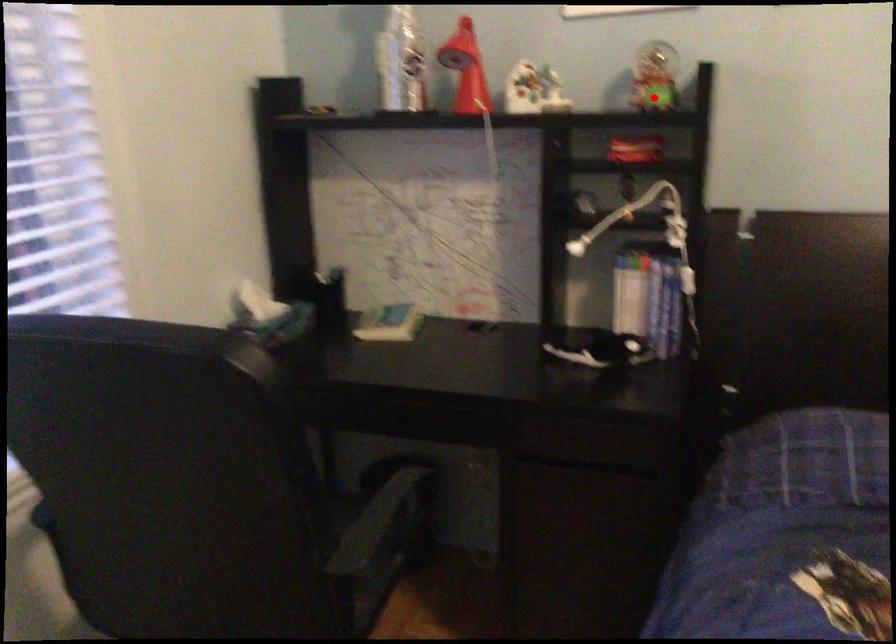
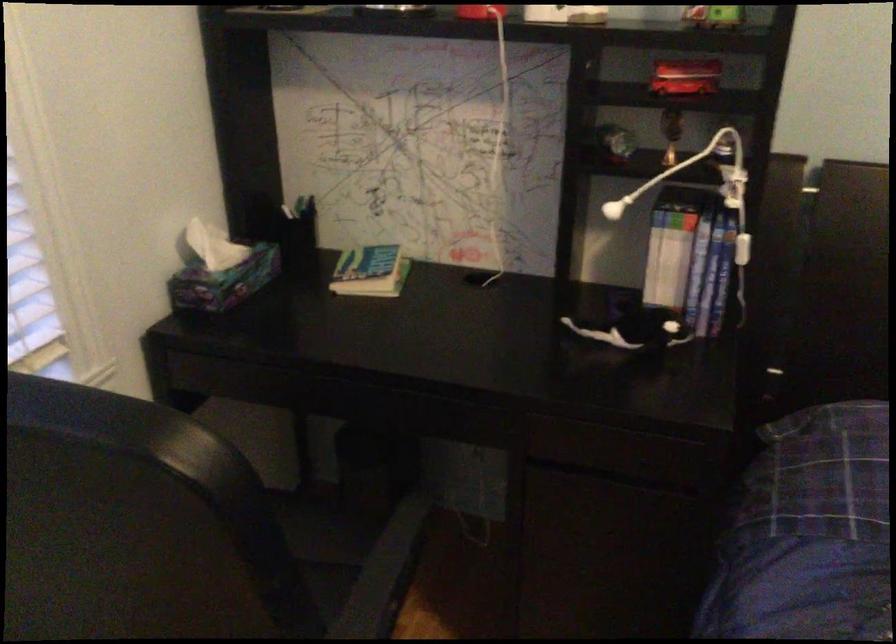
Find the pixel in the second image that matches the highlighted location in the first image.

(713, 17)